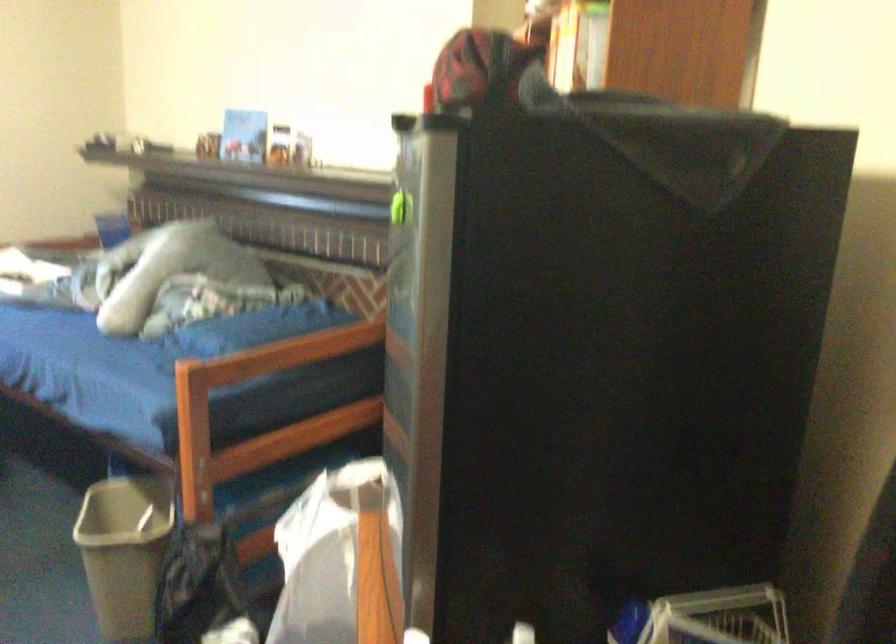
Locate an element on the screen. Image resolution: width=896 pixels, height=644 pixels. red and black cap is located at coordinates (478, 68).